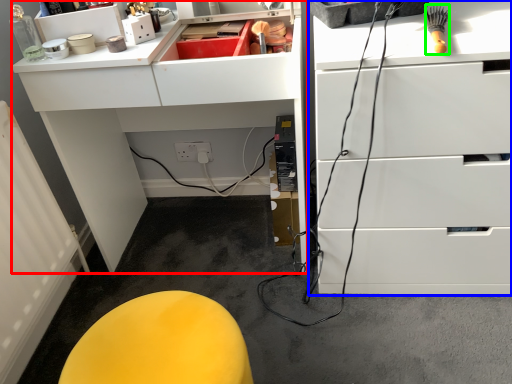
Question: Considering the real-world distances, which object is farthest from computer desk (highlighted by a red box)? chest of drawers (highlighted by a blue box) or brush (highlighted by a green box)?

Choices:
 (A) chest of drawers
 (B) brush

Answer: (B)